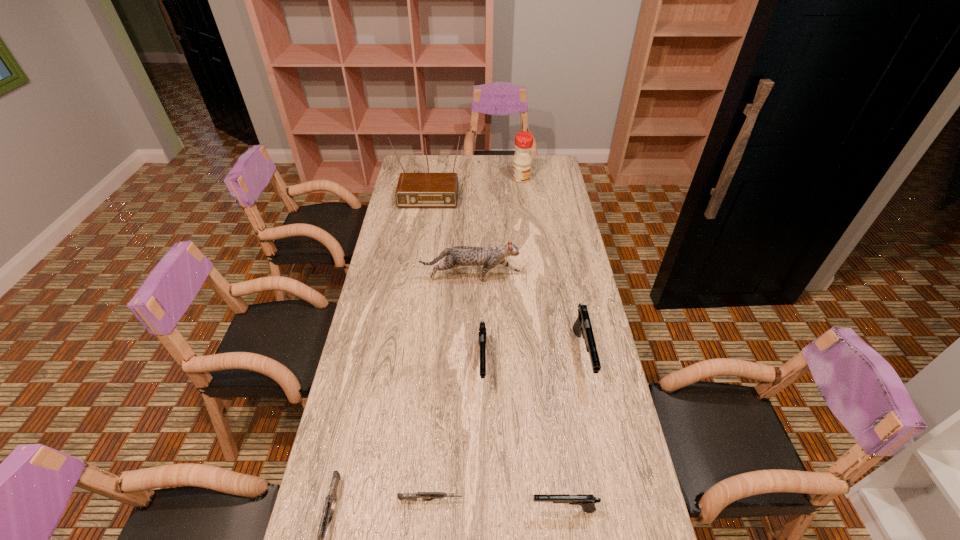
Identify the location of vacant space at the far left corner. The width and height of the screenshot is (960, 540). (410, 168).

Find the location of `free spot between the condiment and the shortest gun`. free spot between the condiment and the shortest gun is located at coordinates point(476,340).

Locate an element on the screen. The image size is (960, 540). free spot between the radio_receiver and the rightmost gun is located at coordinates (505, 273).

Image resolution: width=960 pixels, height=540 pixels. Find the location of `free space between the sixth nearest object and the second black gun from right to left`. free space between the sixth nearest object and the second black gun from right to left is located at coordinates (517, 393).

At what (x,y) coordinates should I click in order to perform the action: click on free space that is in between the red condiment and the fifth shortest object. Please return your answer as a coordinate pair (x, y). The width and height of the screenshot is (960, 540). Looking at the image, I should click on (552, 267).

Locate which object is the seventh closest to the third tallest object. Please provide its 2D coordinates. Your answer should be formatted as a tuple, i.e. [(x, y)], where the tuple contains the x and y coordinates of a point satisfying the conditions above.

[(587, 501)]

Choose which object is the fourth nearest neighbor to the rightmost object. Please provide its 2D coordinates. Your answer should be formatted as a tuple, i.e. [(x, y)], where the tuple contains the x and y coordinates of a point satisfying the conditions above.

[(425, 496)]

Point out which gun is positioned as the third nearest to the radio_receiver. Please provide its 2D coordinates. Your answer should be formatted as a tuple, i.e. [(x, y)], where the tuple contains the x and y coordinates of a point satisfying the conditions above.

[(327, 514)]

Locate which gun is the fourth closest to the leftmost gun. Please provide its 2D coordinates. Your answer should be formatted as a tuple, i.e. [(x, y)], where the tuple contains the x and y coordinates of a point satisfying the conditions above.

[(582, 326)]

This screenshot has width=960, height=540. Find the location of `black gun that is the closest to the seventh tallest object`. black gun that is the closest to the seventh tallest object is located at coordinates (482, 334).